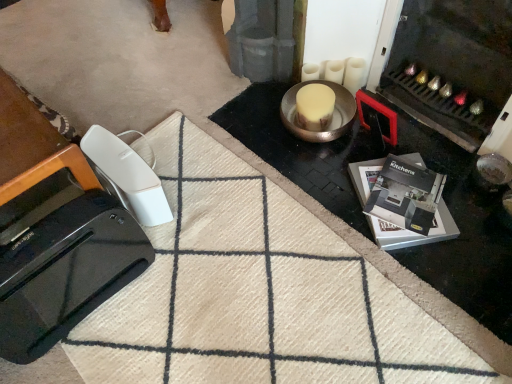
The image size is (512, 384). In order to click on vacant area that is in front of black glossy kitchens brochure at lower right in this screenshot , I will do `click(451, 281)`.